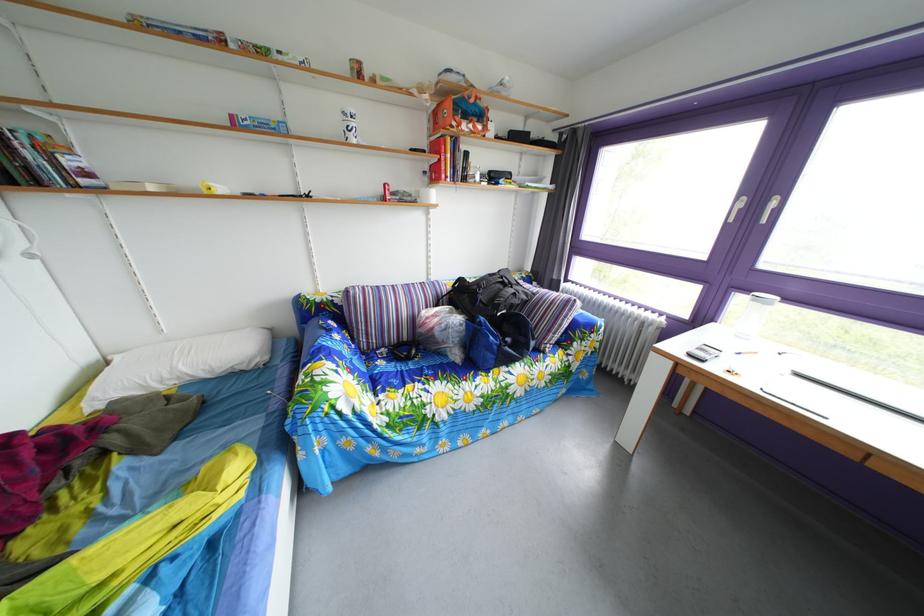
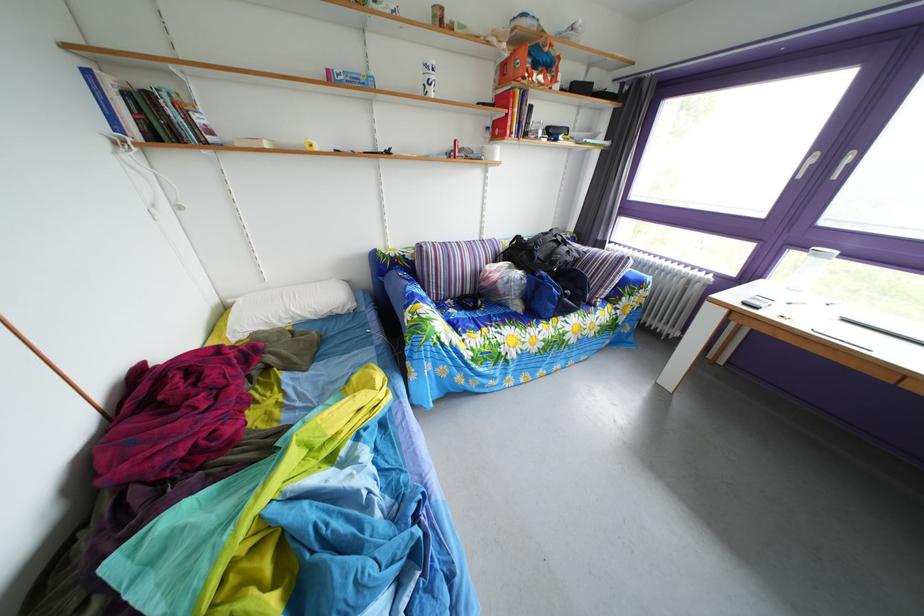
In the second image, find the point that corresponds to the point at 391,371 in the first image.

(463, 320)